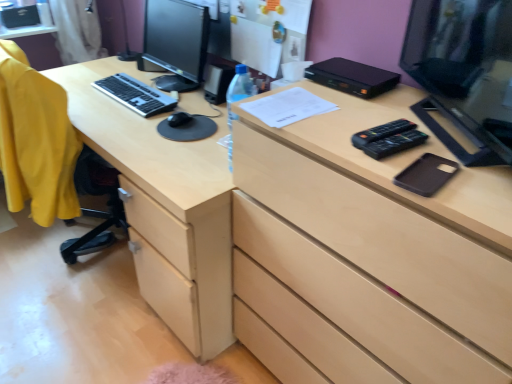
Question: Can you confirm if light wood chest of drawers at center is taller than matte black monitor at center left, the first computer monitor positioned from the back?

Choices:
 (A) no
 (B) yes

Answer: (B)

Question: Can you confirm if light wood chest of drawers at center is positioned to the right of matte black monitor at center left, marked as the second computer monitor in a right-to-left arrangement?

Choices:
 (A) yes
 (B) no

Answer: (A)

Question: Could you tell me if light wood chest of drawers at center is turned towards matte black monitor at center left, the first computer monitor positioned from the back?

Choices:
 (A) no
 (B) yes

Answer: (A)

Question: Is light wood chest of drawers at center to the left of matte black monitor at center left, marked as the second computer monitor in a right-to-left arrangement, from the viewer's perspective?

Choices:
 (A) yes
 (B) no

Answer: (B)

Question: From a real-world perspective, does light wood chest of drawers at center stand above matte black monitor at center left, the first computer monitor positioned from the back?

Choices:
 (A) yes
 (B) no

Answer: (B)

Question: From a real-world perspective, is white paper at center positioned above or below black glossy monitor at upper right, which ranks as the 1th computer monitor in right-to-left order?

Choices:
 (A) above
 (B) below

Answer: (B)

Question: Considering the positions of white paper at center and black glossy monitor at upper right, which ranks as the 1th computer monitor in right-to-left order, in the image, is white paper at center wider or thinner than black glossy monitor at upper right, which ranks as the 1th computer monitor in right-to-left order,?

Choices:
 (A) wide
 (B) thin

Answer: (A)

Question: Considering the relative positions of white paper at center and black glossy monitor at upper right, the first computer monitor from the front, in the image provided, is white paper at center to the left or to the right of black glossy monitor at upper right, the first computer monitor from the front,?

Choices:
 (A) left
 (B) right

Answer: (A)

Question: Is white paper at center in front of or behind black glossy monitor at upper right, the second computer monitor positioned from the back, in the image?

Choices:
 (A) front
 (B) behind

Answer: (B)

Question: Relative to black glossy monitor at upper right, which ranks as the 1th computer monitor in right-to-left order, is black matte phone case at right in front or behind?

Choices:
 (A) behind
 (B) front

Answer: (A)

Question: Do you think black matte phone case at right is within black glossy monitor at upper right, the first computer monitor from the front, or outside of it?

Choices:
 (A) inside
 (B) outside

Answer: (B)

Question: From a real-world perspective, relative to black glossy monitor at upper right, which is counted as the 2th computer monitor, starting from the left, is black matte phone case at right vertically above or below?

Choices:
 (A) below
 (B) above

Answer: (A)

Question: Is point (435, 192) positioned closer to the camera than point (457, 89)?

Choices:
 (A) closer
 (B) farther

Answer: (A)

Question: Considering the positions of point (172, 241) and point (501, 109), is point (172, 241) closer or farther from the camera than point (501, 109)?

Choices:
 (A) farther
 (B) closer

Answer: (A)

Question: From the image's perspective, is light wood desk at center above or below black glossy monitor at upper right, the second computer monitor positioned from the back?

Choices:
 (A) below
 (B) above

Answer: (A)